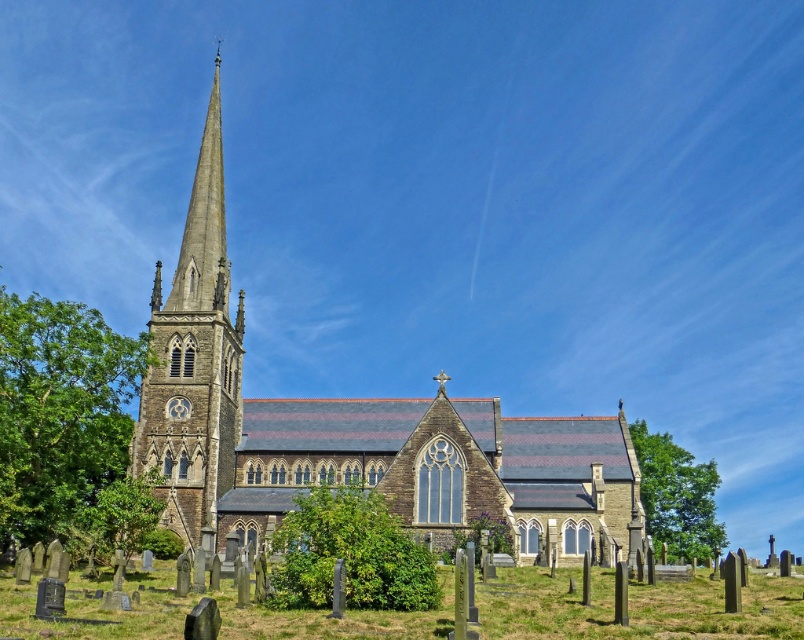
Question: Which point is farther from the camera taking this photo?

Choices:
 (A) (388, 531)
 (B) (442, 472)
 (C) (60, 467)

Answer: (C)

Question: Does gray stone spire at center-left appear on the right side of green leafy bush at center?

Choices:
 (A) no
 (B) yes

Answer: (A)

Question: Is stone church at center to the left of green leafy tree at lower right from the viewer's perspective?

Choices:
 (A) yes
 (B) no

Answer: (A)

Question: Can you confirm if green grass at lower center is positioned to the left of green leafy bush at center?

Choices:
 (A) no
 (B) yes

Answer: (A)

Question: Estimate the real-world distances between objects in this image. Which object is closer to the stone church at center?

Choices:
 (A) gray stone spire at center-left
 (B) green leafy tree at left
 (C) green leafy bush at center
 (D) green grass at lower center

Answer: (A)

Question: Considering the real-world distances, which object is closest to the green leafy tree at left?

Choices:
 (A) green grass at lower center
 (B) stone church at center
 (C) green leafy tree at lower right
 (D) gray stone spire at center-left

Answer: (D)